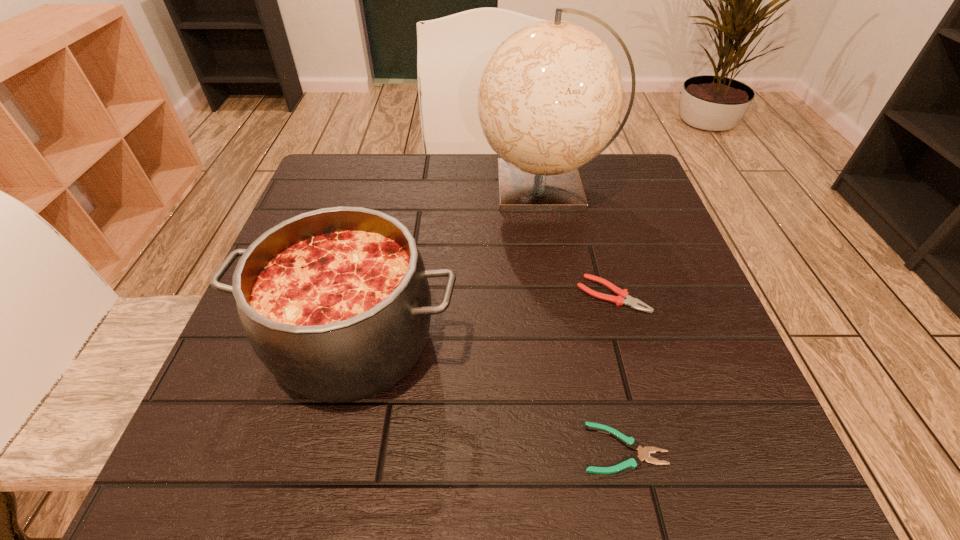
The width and height of the screenshot is (960, 540). What are the coordinates of `unoccupied area between the leftmost object and the third tallest object` in the screenshot? It's located at (483, 318).

This screenshot has height=540, width=960. In order to click on unoccupied area between the second shortest object and the globe in this screenshot , I will do `click(578, 241)`.

Locate an element on the screen. The width and height of the screenshot is (960, 540). blank region between the taller pliers and the globe is located at coordinates (578, 241).

Locate an element on the screen. vacant area that lies between the shortest object and the farther pliers is located at coordinates (618, 372).

Locate an element on the screen. The width and height of the screenshot is (960, 540). free space between the shortest object and the third shortest object is located at coordinates (489, 394).

At what (x,y) coordinates should I click in order to perform the action: click on empty space between the farther pliers and the nearest object. Please return your answer as a coordinate pair (x, y). The image size is (960, 540). Looking at the image, I should click on (618, 372).

In order to click on vacant space in between the casserole and the farthest object in this screenshot , I will do `click(449, 264)`.

The width and height of the screenshot is (960, 540). Find the location of `empty space that is in between the tallest object and the farther pliers`. empty space that is in between the tallest object and the farther pliers is located at coordinates (578, 241).

What are the coordinates of `object that stands as the closest to the shortest object` in the screenshot? It's located at click(335, 302).

Identify which object is located as the second nearest to the shortest object. Please provide its 2D coordinates. Your answer should be formatted as a tuple, i.e. [(x, y)], where the tuple contains the x and y coordinates of a point satisfying the conditions above.

[(623, 298)]